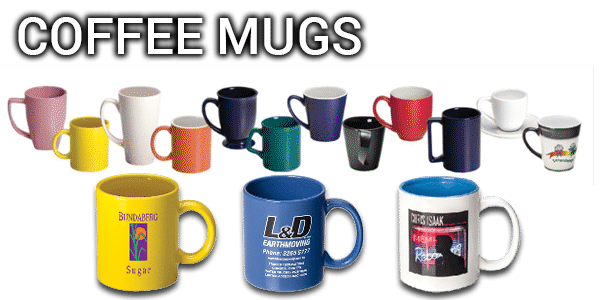
Identify the location of blue mug. (266, 228).